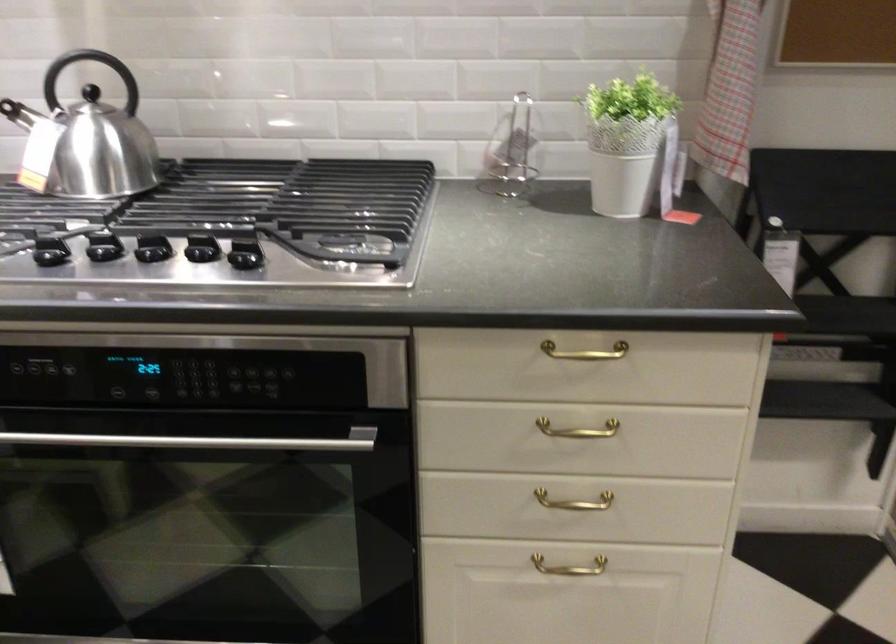
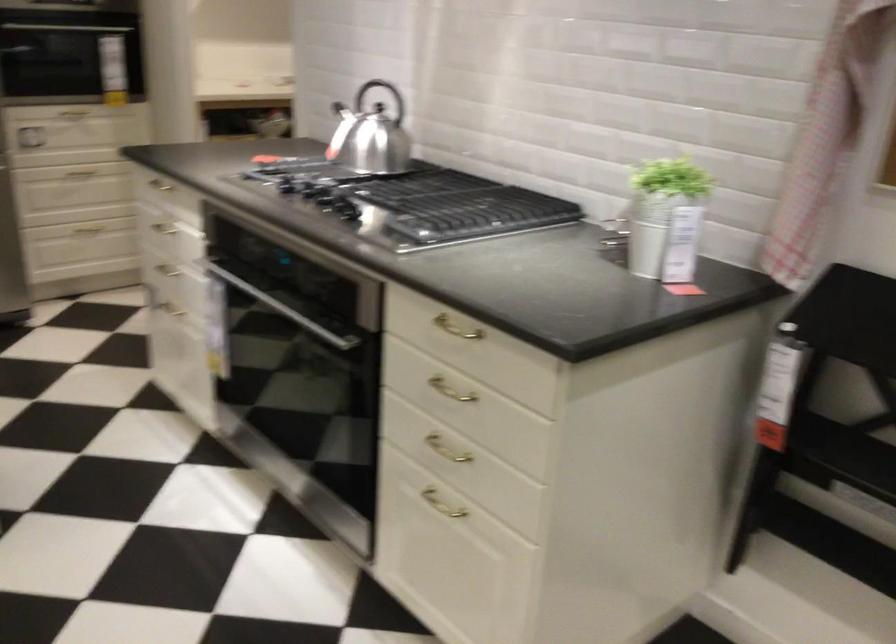
Where in the second image is the point corresponding to pixel 804 355 from the first image?

(859, 500)